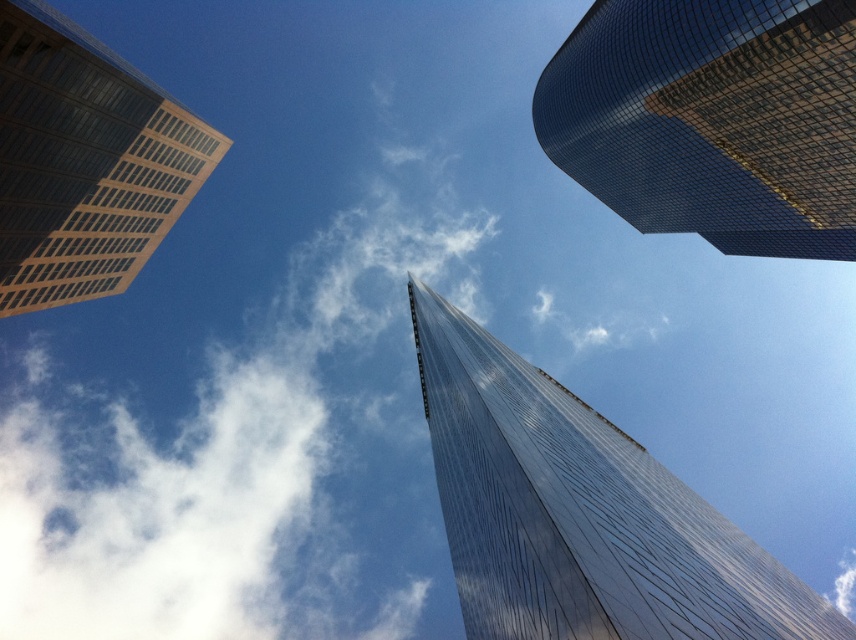
Question: Estimate the real-world distances between objects in this image. Which object is closer to the brown glass skyscraper at upper left?

Choices:
 (A) white fluffy cloud at upper center
 (B) reflective glass skyscraper at center
 (C) glossy glass skyscraper at upper right

Answer: (B)

Question: Considering the real-world distances, which object is farthest from the brown glass skyscraper at upper left?

Choices:
 (A) glossy glass skyscraper at upper right
 (B) reflective glass skyscraper at center

Answer: (A)

Question: Considering the relative positions of white fluffy cloud at upper center and brown glass skyscraper at upper left in the image provided, where is white fluffy cloud at upper center located with respect to brown glass skyscraper at upper left?

Choices:
 (A) above
 (B) below

Answer: (B)

Question: Can you confirm if glossy glass skyscraper at upper right is bigger than brown glass skyscraper at upper left?

Choices:
 (A) yes
 (B) no

Answer: (A)

Question: Which point is closer to the camera?

Choices:
 (A) white fluffy cloud at upper center
 (B) brown glass skyscraper at upper left
 (C) reflective glass skyscraper at center
 (D) glossy glass skyscraper at upper right

Answer: (C)

Question: Can you confirm if reflective glass skyscraper at center is positioned to the left of glossy glass skyscraper at upper right?

Choices:
 (A) no
 (B) yes

Answer: (B)